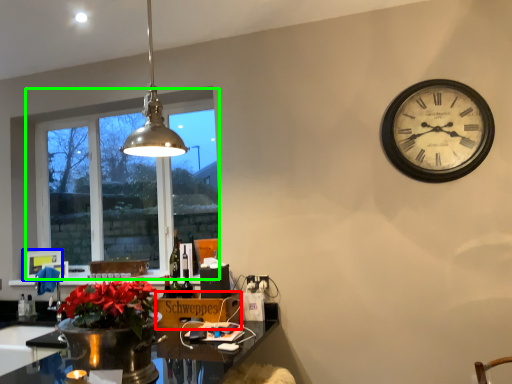
Question: Considering the real-world distances, which object is farthest from cardboard box (highlighted by a red box)? picture frame (highlighted by a blue box) or window (highlighted by a green box)?

Choices:
 (A) picture frame
 (B) window

Answer: (A)